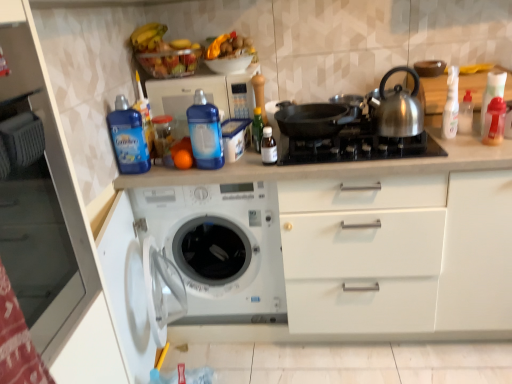
What do you see at coordinates (451, 105) in the screenshot? The height and width of the screenshot is (384, 512). I see `white plastic spray bottle at upper right, placed as the 6th bottle when sorted from left to right` at bounding box center [451, 105].

The width and height of the screenshot is (512, 384). What do you see at coordinates (465, 114) in the screenshot?
I see `transparent plastic spray bottle at right, which is the seventh bottle in left-to-right order` at bounding box center [465, 114].

Describe the element at coordinates (163, 138) in the screenshot. This screenshot has width=512, height=384. I see `translucent plastic container at center, placed as the seventh bottle when sorted from right to left` at that location.

This screenshot has height=384, width=512. I want to click on translucent plastic container at center, which is the 2th bottle from left to right, so click(163, 138).

Find the location of a particular element. white plastic spray bottle at upper right, placed as the 6th bottle when sorted from left to right is located at coordinates (451, 105).

Is white plastic spray bottle at upper right, arranged as the 3th bottle when viewed from the right, aimed at black matte pan at center?

No.

Is black matte pan at center surrounded by white plastic spray bottle at upper right, placed as the 6th bottle when sorted from left to right?

No, black matte pan at center is located outside of white plastic spray bottle at upper right, placed as the 6th bottle when sorted from left to right.

In terms of height, does white plastic spray bottle at upper right, arranged as the 3th bottle when viewed from the right, look taller or shorter compared to black matte pan at center?

Clearly, white plastic spray bottle at upper right, arranged as the 3th bottle when viewed from the right, is taller compared to black matte pan at center.

There is a black matte pan at center. Identify the location of the 6th bottle above it (from a real-world perspective). This screenshot has height=384, width=512. (451, 105).

Who is more distant, blue plastic microwave at upper center or white plastic washing machine at lower left?

blue plastic microwave at upper center is further from the camera.

Which of these two, blue plastic microwave at upper center or white plastic washing machine at lower left, is wider?

white plastic washing machine at lower left.

Does blue plastic microwave at upper center appear on the left side of white plastic washing machine at lower left?

Correct, you'll find blue plastic microwave at upper center to the left of white plastic washing machine at lower left.

Consider the image. Who is smaller, blue plastic microwave at upper center or white plastic washing machine at lower left?

Smaller between the two is blue plastic microwave at upper center.

Considering the relative positions of blue plastic microwave at upper center and transparent plastic spray bottle at right, which is the seventh bottle in left-to-right order, in the image provided, is blue plastic microwave at upper center to the left of transparent plastic spray bottle at right, which is the seventh bottle in left-to-right order, from the viewer's perspective?

Correct, you'll find blue plastic microwave at upper center to the left of transparent plastic spray bottle at right, which is the seventh bottle in left-to-right order.

Is point (188, 92) less distant than point (460, 113)?

That is False.

Looking at this image, would you say blue plastic microwave at upper center is outside transparent plastic spray bottle at right, which ranks as the 2th bottle in right-to-left order?

Yes, blue plastic microwave at upper center is located beyond the bounds of transparent plastic spray bottle at right, which ranks as the 2th bottle in right-to-left order.

Looking at this image, measure the distance between white plastic spray bottle at upper right, arranged as the 3th bottle when viewed from the right, and white matte cabinet at left.

white plastic spray bottle at upper right, arranged as the 3th bottle when viewed from the right, and white matte cabinet at left are 4.84 feet apart from each other.

Is white plastic spray bottle at upper right, arranged as the 3th bottle when viewed from the right, in front of or behind white matte cabinet at left in the image?

Visually, white plastic spray bottle at upper right, arranged as the 3th bottle when viewed from the right, is located behind white matte cabinet at left.

Which of these two, white plastic spray bottle at upper right, arranged as the 3th bottle when viewed from the right, or white matte cabinet at left, is wider?

Wider between the two is white matte cabinet at left.

Between white plastic spray bottle at upper right, placed as the 6th bottle when sorted from left to right, and white matte cabinet at left, which one appears on the left side from the viewer's perspective?

Positioned to the left is white matte cabinet at left.

Considering the points (246, 101) and (169, 142), which point is in front, point (246, 101) or point (169, 142)?

The point (169, 142) is in front.

Considering the relative sizes of blue plastic microwave at upper center and translucent plastic container at center, which is the 2th bottle from left to right, in the image provided, is blue plastic microwave at upper center taller than translucent plastic container at center, which is the 2th bottle from left to right,?

Indeed, blue plastic microwave at upper center has a greater height compared to translucent plastic container at center, which is the 2th bottle from left to right.

Does white matte cabinet at left appear on the right side of black matte pan at center?

No.

Could you tell me if white matte cabinet at left is facing black matte pan at center?

No, white matte cabinet at left is not facing towards black matte pan at center.

From a real-world perspective, is white matte cabinet at left positioned above or below black matte pan at center?

Clearly, from a real-world perspective, white matte cabinet at left is above black matte pan at center.

Is white matte cabinet at left not close to black matte pan at center?

No, white matte cabinet at left is not far from black matte pan at center.

Which is correct: translucent plastic bottle at right, which is counted as the 8th bottle, starting from the left, is inside white matte cabinet at left, or outside of it?

translucent plastic bottle at right, which is counted as the 8th bottle, starting from the left, is not enclosed by white matte cabinet at left.

From a real-world perspective, is translucent plastic bottle at right, positioned as the 1th bottle in right-to-left order, above or below white matte cabinet at left?

In terms of real-world spatial position, translucent plastic bottle at right, positioned as the 1th bottle in right-to-left order, is below white matte cabinet at left.

Is point (486, 138) behind point (73, 360)?

Yes, it is behind point (73, 360).

From the black matte pan at center, count 1st bottle to the right and point to it. Please provide its 2D coordinates.

[(451, 105)]

Where is `washing machine that is under the blue plastic microwave at upper center (from a real-world perspective)`? washing machine that is under the blue plastic microwave at upper center (from a real-world perspective) is located at coordinates (220, 248).

From the image, which object appears to be nearer to green glass bottle at center, the fourth bottle when ordered from left to right, black matte pan at center or blue translucent bottle at center, positioned as the sixth bottle in right-to-left order?

blue translucent bottle at center, positioned as the sixth bottle in right-to-left order.

Estimate the real-world distances between objects in this image. Which object is further from orange matte at center, shiny metallic kettle at upper right or black matte frying pan at center?

shiny metallic kettle at upper right is further to orange matte at center.

Based on their spatial positions, is transparent plastic spray bottle at right, which ranks as the 2th bottle in right-to-left order, or white plastic washing machine at lower left closer to translucent plastic bottle at right, positioned as the 1th bottle in right-to-left order?

Among the two, transparent plastic spray bottle at right, which ranks as the 2th bottle in right-to-left order, is located nearer to translucent plastic bottle at right, positioned as the 1th bottle in right-to-left order.

Which object lies further to the anchor point black matte pan at center, orange matte at center or white plastic washing machine at lower left?

orange matte at center.

Based on their spatial positions, is transparent plastic spray bottle at right, which ranks as the 2th bottle in right-to-left order, or transparent plastic bottle at center, which is counted as the 5th bottle, starting from the left, closer to shiny metallic kettle at upper right?

Based on the image, transparent plastic spray bottle at right, which ranks as the 2th bottle in right-to-left order, appears to be nearer to shiny metallic kettle at upper right.

Looking at this image, considering their positions, is white matte cabinet at left positioned further to white plastic washing machine at lower left than translucent plastic bottle at right, which is counted as the 8th bottle, starting from the left?

translucent plastic bottle at right, which is counted as the 8th bottle, starting from the left, lies further to white plastic washing machine at lower left than the other object.

Which object lies nearer to the anchor point orange matte at center, translucent plastic container at center, which is the 2th bottle from left to right, or transparent plastic spray bottle at right, which ranks as the 2th bottle in right-to-left order?

The object closer to orange matte at center is translucent plastic container at center, which is the 2th bottle from left to right.

When comparing their distances from blue plastic microwave at upper center, does transparent plastic spray bottle at right, which is the seventh bottle in left-to-right order, or white matte cabinet at left seem closer?

white matte cabinet at left.

Where is `appliance between blue plastic bottle at upper left, placed as the 1th bottle when sorted from left to right, and shiny metallic kettle at upper right`? appliance between blue plastic bottle at upper left, placed as the 1th bottle when sorted from left to right, and shiny metallic kettle at upper right is located at coordinates pyautogui.click(x=205, y=95).

Locate an element on the screen. gas stove between blue plastic microwave at upper center and transparent plastic spray bottle at right, which is the seventh bottle in left-to-right order is located at coordinates (356, 147).

Where is `gas stove between blue translucent bottle at center, the 3th bottle from the left, and translucent plastic bottle at right, positioned as the 1th bottle in right-to-left order`? This screenshot has height=384, width=512. gas stove between blue translucent bottle at center, the 3th bottle from the left, and translucent plastic bottle at right, positioned as the 1th bottle in right-to-left order is located at coordinates (356, 147).

This screenshot has height=384, width=512. I want to click on frying pan located between blue plastic microwave at upper center and white plastic spray bottle at upper right, arranged as the 3th bottle when viewed from the right, in the left-right direction, so click(x=314, y=119).